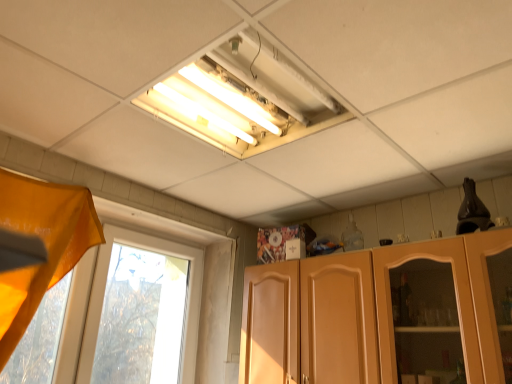
Question: Is transparent glass window at left to the right of matte wood cabinet at lower right from the viewer's perspective?

Choices:
 (A) no
 (B) yes

Answer: (A)

Question: From the image's perspective, is transparent glass window at left on top of matte wood cabinet at lower right?

Choices:
 (A) yes
 (B) no

Answer: (A)

Question: Does transparent glass window at left turn towards matte wood cabinet at lower right?

Choices:
 (A) no
 (B) yes

Answer: (B)

Question: Is transparent glass window at left shorter than matte wood cabinet at lower right?

Choices:
 (A) yes
 (B) no

Answer: (B)

Question: From a real-world perspective, is transparent glass window at left under matte wood cabinet at lower right?

Choices:
 (A) yes
 (B) no

Answer: (B)

Question: Considering the positions of matte wood cabinet at lower right and transparent glass window at left in the image, is matte wood cabinet at lower right taller or shorter than transparent glass window at left?

Choices:
 (A) tall
 (B) short

Answer: (B)

Question: Is matte wood cabinet at lower right to the left or to the right of transparent glass window at left in the image?

Choices:
 (A) left
 (B) right

Answer: (B)

Question: Is matte wood cabinet at lower right wider or thinner than transparent glass window at left?

Choices:
 (A) thin
 (B) wide

Answer: (B)

Question: Does point (416, 264) appear closer or farther from the camera than point (87, 276)?

Choices:
 (A) farther
 (B) closer

Answer: (B)

Question: From the image's perspective, relative to orange fabric curtain at left, is transparent glass window at left above or below?

Choices:
 (A) below
 (B) above

Answer: (A)

Question: Based on their positions, is transparent glass window at left located to the left or right of orange fabric curtain at left?

Choices:
 (A) left
 (B) right

Answer: (B)

Question: Is transparent glass window at left wider or thinner than orange fabric curtain at left?

Choices:
 (A) thin
 (B) wide

Answer: (A)

Question: Based on their sizes in the image, would you say transparent glass window at left is bigger or smaller than orange fabric curtain at left?

Choices:
 (A) big
 (B) small

Answer: (B)

Question: Is transparent glass window at left to the left or to the right of matte wood cabinet at lower right in the image?

Choices:
 (A) right
 (B) left

Answer: (B)

Question: Looking at their shapes, would you say transparent glass window at left is wider or thinner than matte wood cabinet at lower right?

Choices:
 (A) wide
 (B) thin

Answer: (B)